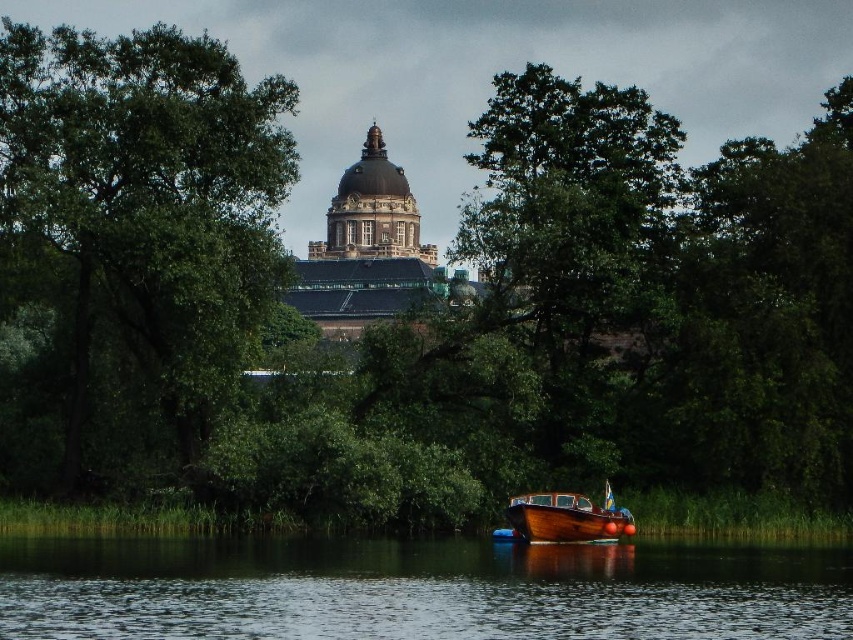
You are standing at the lakeside and see the transparent water at lower center and the wooden boat at lower center. Which object is positioned lower in the scene?

The transparent water at lower center is positioned below the wooden boat at lower center, so it is lower in the scene.

From the picture: You are standing on the lakeside and want to take a photo of the wooden boat at lower center. To include the reflection of the historical building in the background, where should you position yourself relative to the transparent water at lower center?

You should position yourself to the right of the transparent water at lower center because the transparent water at lower center is to the left of the wooden boat at lower center, so standing on the right side of the transparent water at lower center will allow you to capture the reflection of the historical building in the water while framing the wooden boat at lower center.

You are standing at the lakeside and want to place a 20 meter long floating dock between the green leafy tree at left and the transparent water at lower center. Is there enough space between them to fit the dock?

The distance between the green leafy tree at left and the transparent water at lower center is 19.82 meters. Since the dock is 20 meters long, it is slightly too long to fit in the available space.